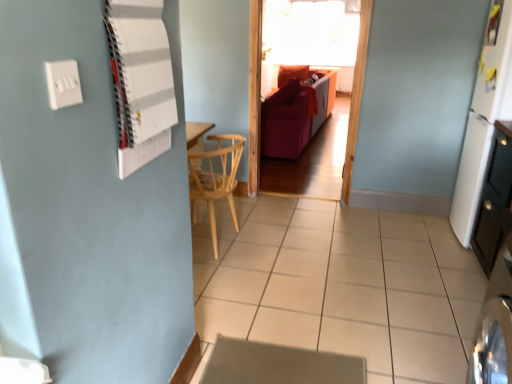
Identify the location of free area below transparent glass door at center (from a real-world perspective). Image resolution: width=512 pixels, height=384 pixels. (305, 198).